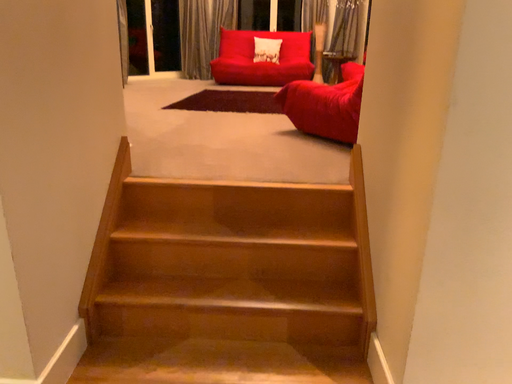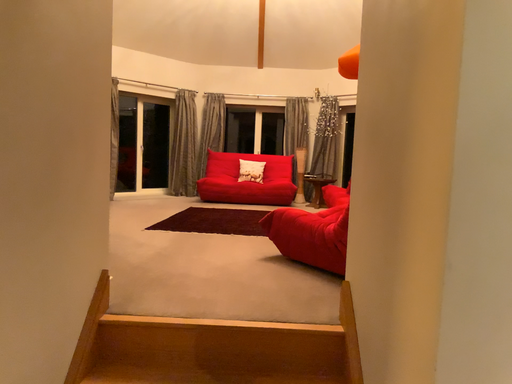
Question: How did the camera likely rotate when shooting the video?

Choices:
 (A) rotated downward
 (B) rotated upward

Answer: (B)